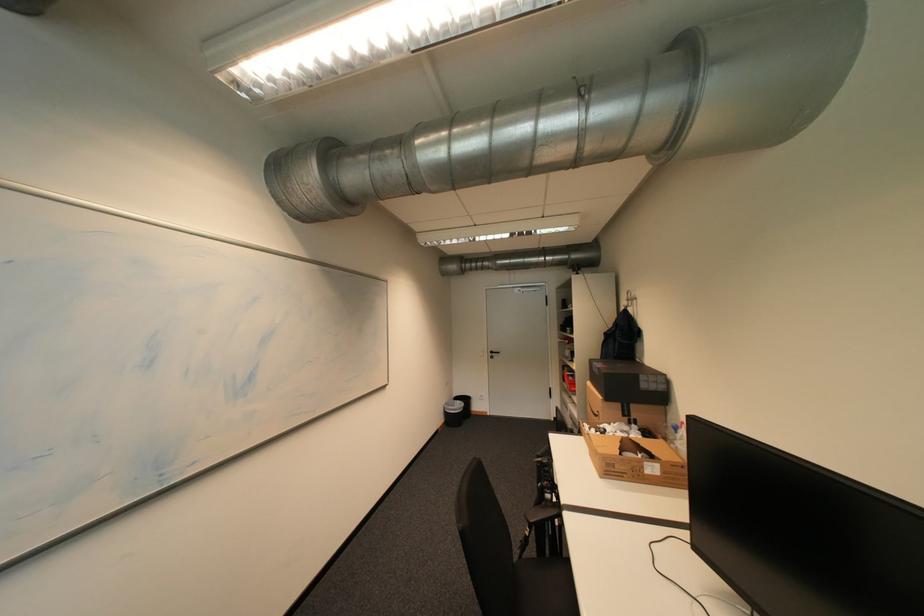
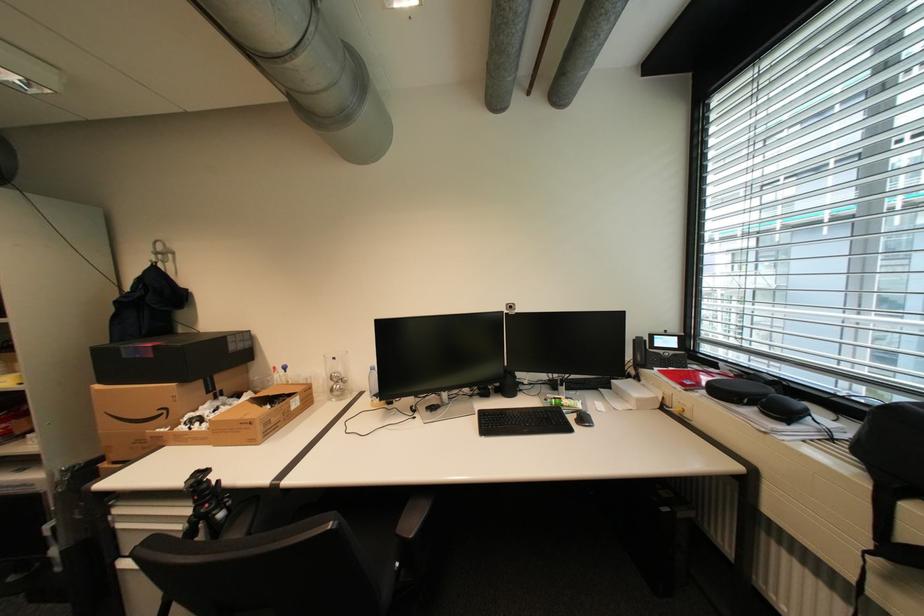
Locate, in the second image, the point that corresponds to [637,301] in the first image.

(165, 254)